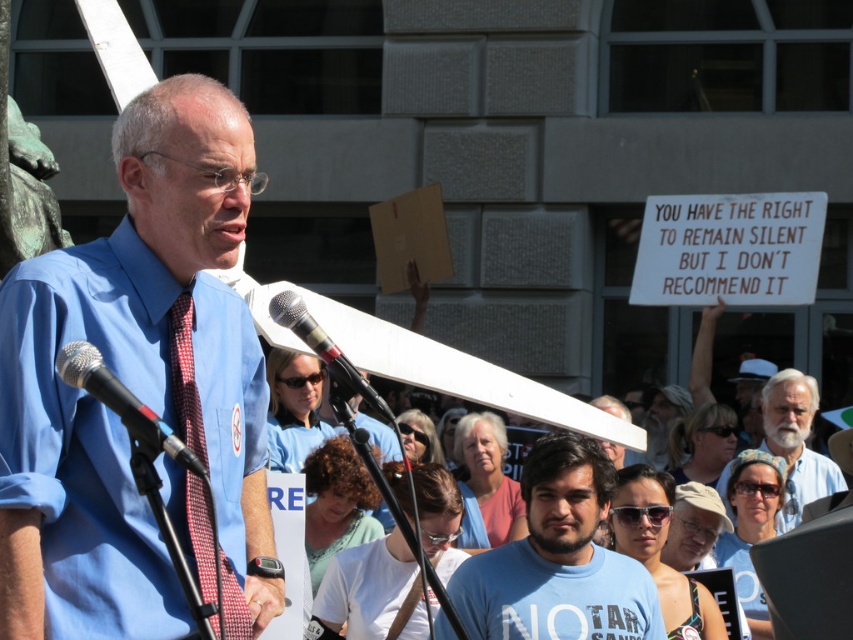
Question: Considering the relative positions of blue t-shirt at center and silver metallic microphone at center in the image provided, where is blue t-shirt at center located with respect to silver metallic microphone at center?

Choices:
 (A) right
 (B) left

Answer: (A)

Question: Which point is closer to the camera?

Choices:
 (A) white beard at center
 (B) blue t-shirt at center

Answer: (B)

Question: Which of the following is the farthest from the observer?

Choices:
 (A) silver metallic microphone at center
 (B) white beard at center
 (C) blue cotton shirt at center

Answer: (B)

Question: Which object appears closest to the camera in this image?

Choices:
 (A) blue cotton shirt at center
 (B) black metallic microphone at center
 (C) silver metallic microphone at center

Answer: (B)

Question: Can you confirm if matte blue shirt at center is positioned to the right of white beard at center?

Choices:
 (A) yes
 (B) no

Answer: (B)

Question: Is blue t-shirt at center bigger than silver metallic microphone at center?

Choices:
 (A) yes
 (B) no

Answer: (A)